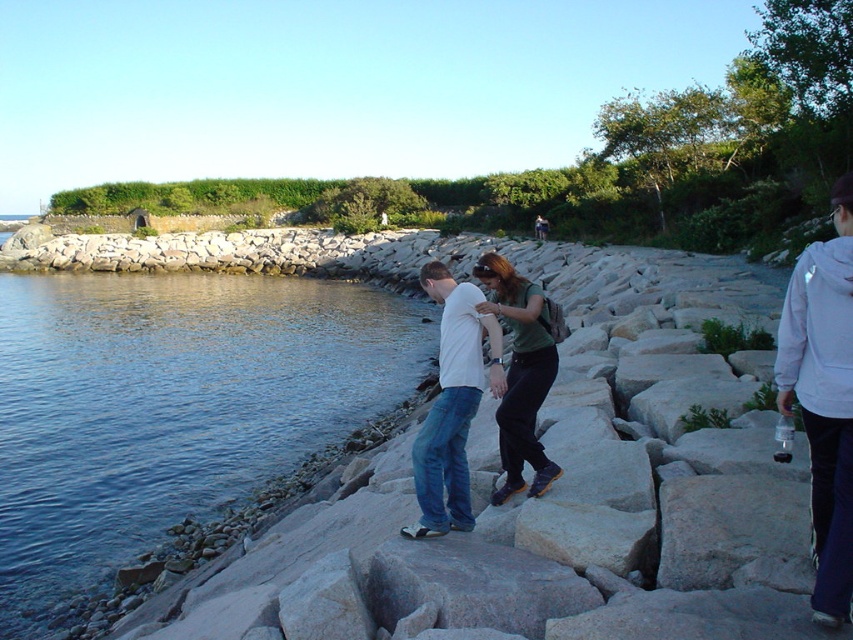
Question: Is white fleece jacket at right closer to camera compared to green fabric shirt at center?

Choices:
 (A) no
 (B) yes

Answer: (B)

Question: Among these points, which one is nearest to the camera?

Choices:
 (A) (264, 284)
 (B) (517, 378)
 (C) (498, 433)

Answer: (B)

Question: Does white fleece jacket at right appear over green fabric shirt at center?

Choices:
 (A) no
 (B) yes

Answer: (A)

Question: Among these points, which one is farthest from the camera?

Choices:
 (A) (532, 355)
 (B) (462, 404)
 (C) (292, 456)

Answer: (C)

Question: Estimate the real-world distances between objects in this image. Which object is closer to the white fleece jacket at right?

Choices:
 (A) green fabric shirt at center
 (B) blue water at lower left
 (C) white cotton shirt at center

Answer: (C)

Question: Does white fleece jacket at right appear on the right side of white cotton shirt at center?

Choices:
 (A) no
 (B) yes

Answer: (B)